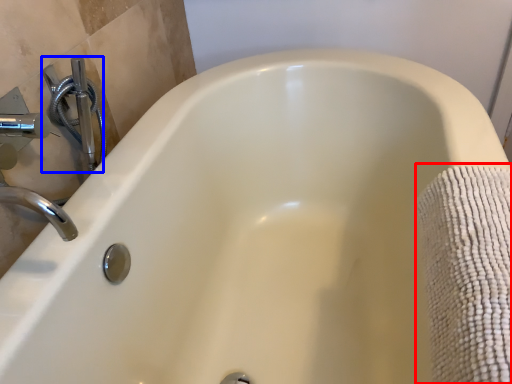
Question: Which object appears closest to the camera in this image, bath towel (highlighted by a red box) or plumbing fixture (highlighted by a blue box)?

Choices:
 (A) bath towel
 (B) plumbing fixture

Answer: (A)